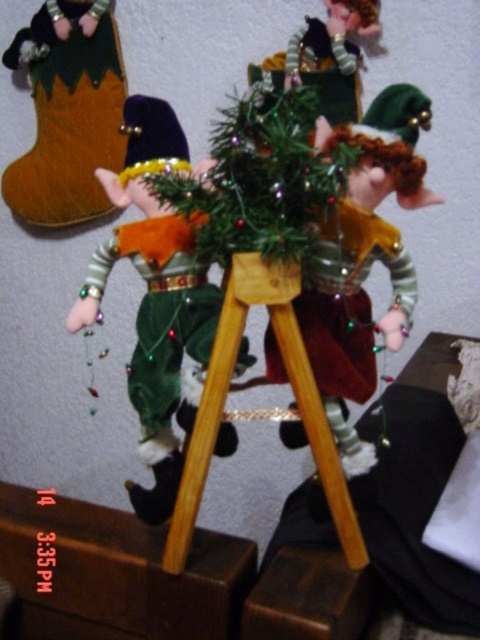
Question: Considering the relative positions of green velvet christmas tree at center and wooden tripod at center in the image provided, where is green velvet christmas tree at center located with respect to wooden tripod at center?

Choices:
 (A) below
 (B) above

Answer: (B)

Question: Does velvet green elf at center appear under velvet boot at left?

Choices:
 (A) no
 (B) yes

Answer: (B)

Question: Which point is farther to the camera?

Choices:
 (A) (119, 113)
 (B) (103, 285)
 (C) (331, 285)

Answer: (A)

Question: From the image, what is the correct spatial relationship of velvet boot at left in relation to wooden tripod at center?

Choices:
 (A) left
 (B) right

Answer: (A)

Question: Which of the following is the closest to the observer?

Choices:
 (A) (262, 268)
 (B) (296, 145)

Answer: (B)

Question: Which object is closer to the camera taking this photo?

Choices:
 (A) wooden tripod at center
 (B) velvet boot at left
 (C) velvet green elf at center
 (D) velvet green elf at left

Answer: (A)